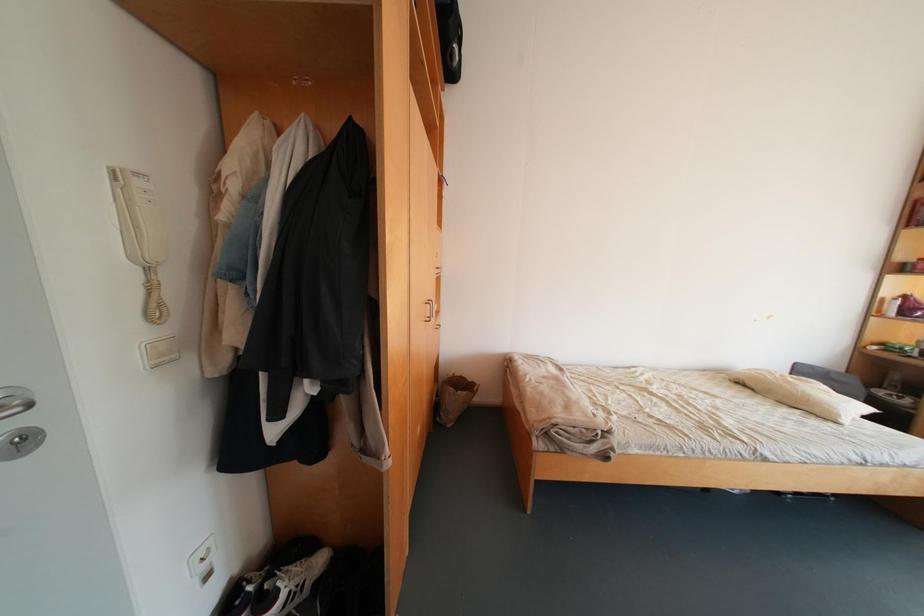
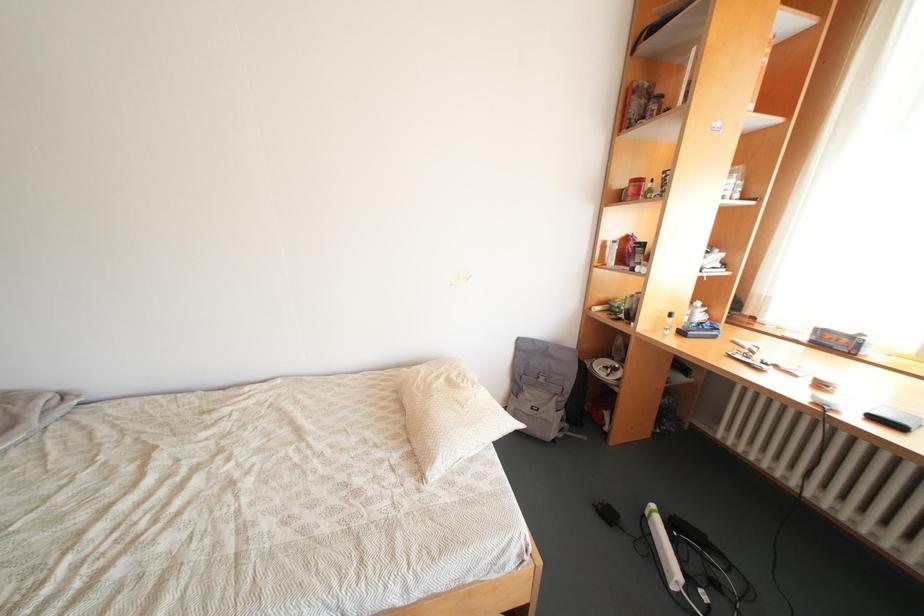
Question: The images are taken continuously from a first-person perspective. In which direction are you moving?

Choices:
 (A) Left
 (B) Right
 (C) Forward
 (D) Backward

Answer: (B)